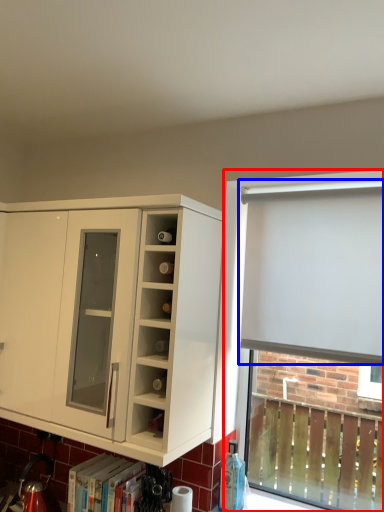
Question: Which object appears closest to the camera in this image, bay window (highlighted by a red box) or curtain (highlighted by a blue box)?

Choices:
 (A) bay window
 (B) curtain

Answer: (B)